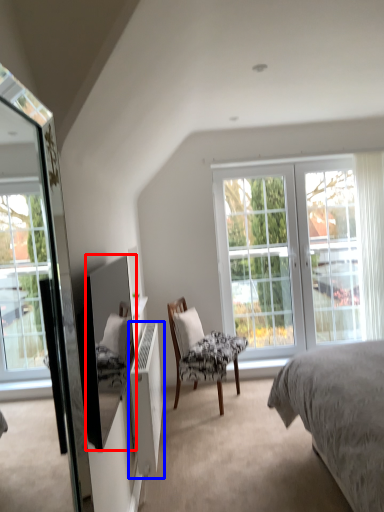
Question: Which object appears farthest to the camera in this image, mirror (highlighted by a red box) or radiator (highlighted by a blue box)?

Choices:
 (A) mirror
 (B) radiator

Answer: (B)